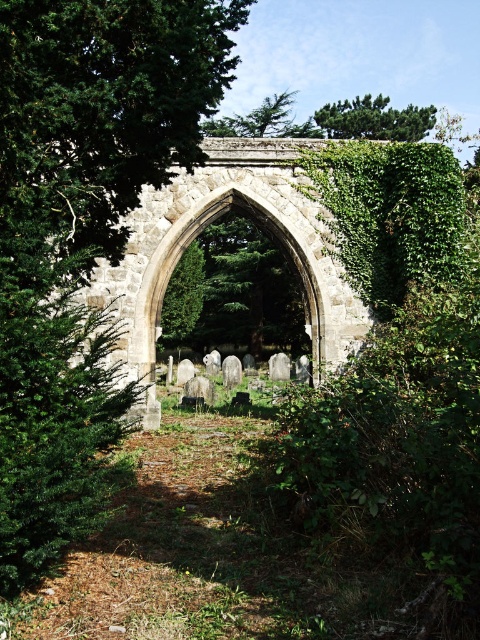
You are standing at the center of the image and want to take a photo of the green leafy tree at center. Which direction should you point your camera to capture it?

The green leafy tree at center is located at point coordinates of (82, 230), so you should point your camera towards the upper left direction to capture it.

You are standing at the point marked by coordinates point (82,230) in the image. What is the nearest object to you?

The nearest object to you is the green leafy tree at center, as the point (82,230) is located on it.